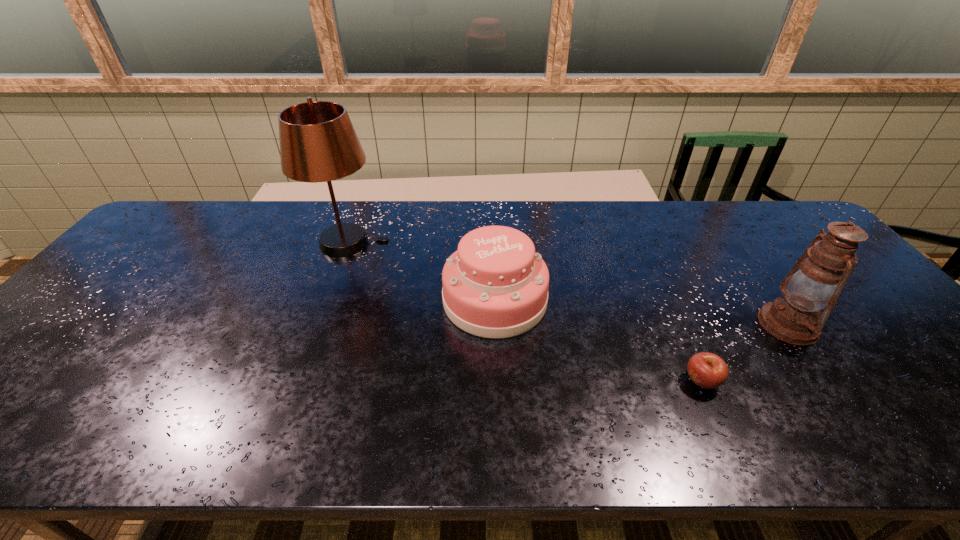
Image resolution: width=960 pixels, height=540 pixels. Find the location of `empty location between the rightmost object and the lampshade`. empty location between the rightmost object and the lampshade is located at coordinates (568, 284).

Find the location of a particular element. The image size is (960, 540). unoccupied area between the apple and the second tallest object is located at coordinates (745, 353).

Identify the location of vacant space that is in between the third shortest object and the leftmost object. (568, 284).

I want to click on vacant area between the lampshade and the oil lamp, so click(x=568, y=284).

Locate an element on the screen. The width and height of the screenshot is (960, 540). vacant area that lies between the third object from right to left and the second tallest object is located at coordinates (641, 312).

Identify which object is the third closest to the oil lamp. Please provide its 2D coordinates. Your answer should be formatted as a tuple, i.e. [(x, y)], where the tuple contains the x and y coordinates of a point satisfying the conditions above.

[(318, 143)]

This screenshot has height=540, width=960. I want to click on object that is the third closest one to the nearest object, so click(318, 143).

This screenshot has width=960, height=540. In order to click on vacant space that satisfies the following two spatial constraints: 1. on the front-facing side of the third object from right to left; 2. on the right side of the lampshade in this screenshot , I will do `click(326, 300)`.

Where is `vacant space that satisfies the following two spatial constraints: 1. on the front-facing side of the leftmost object; 2. on the right side of the birthday cake`? The height and width of the screenshot is (540, 960). vacant space that satisfies the following two spatial constraints: 1. on the front-facing side of the leftmost object; 2. on the right side of the birthday cake is located at coordinates (326, 300).

Image resolution: width=960 pixels, height=540 pixels. I want to click on vacant space that satisfies the following two spatial constraints: 1. on the back side of the oil lamp; 2. on the front-facing side of the lampshade, so click(x=730, y=243).